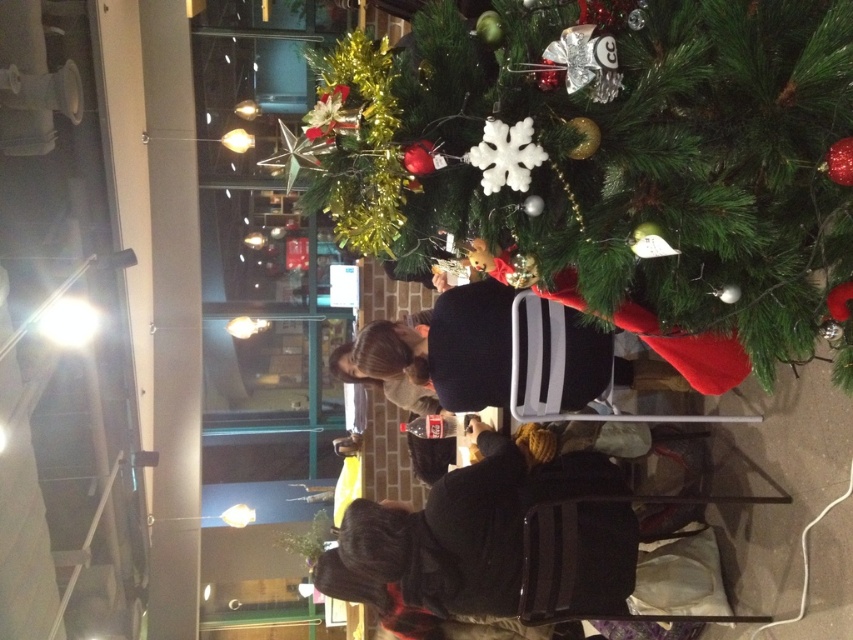
Question: Which point appears farthest from the camera in this image?

Choices:
 (A) (650, 294)
 (B) (543, 394)

Answer: (B)

Question: From the image, what is the correct spatial relationship of green matte christmas tree at center in relation to dark brown sweater at center?

Choices:
 (A) below
 (B) above

Answer: (B)

Question: Can you confirm if green matte christmas tree at center is positioned below dark brown sweater at center?

Choices:
 (A) no
 (B) yes

Answer: (A)

Question: Is green matte christmas tree at center wider than dark brown sweater at center?

Choices:
 (A) yes
 (B) no

Answer: (B)